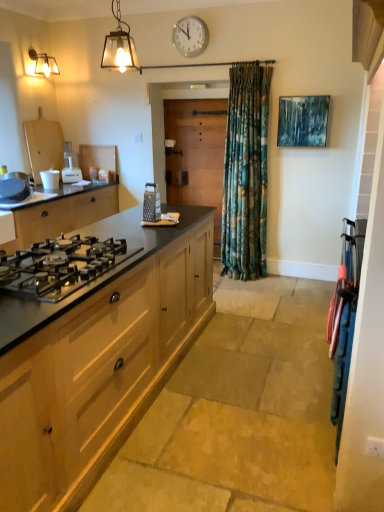
Question: Considering the relative positions of polished stainless steel gas stove at lower left and matte wooden stove at left, the second cabinetry in the right-to-left sequence, in the image provided, is polished stainless steel gas stove at lower left to the right of matte wooden stove at left, the second cabinetry in the right-to-left sequence, from the viewer's perspective?

Choices:
 (A) no
 (B) yes

Answer: (B)

Question: Does polished stainless steel gas stove at lower left have a greater height compared to matte wooden stove at left, the 2th cabinetry viewed from the front?

Choices:
 (A) yes
 (B) no

Answer: (B)

Question: From a real-world perspective, is polished stainless steel gas stove at lower left physically below matte wooden stove at left, the 2th cabinetry viewed from the front?

Choices:
 (A) yes
 (B) no

Answer: (B)

Question: From a real-world perspective, is polished stainless steel gas stove at lower left on top of matte wooden stove at left, which ranks as the 1th cabinetry in left-to-right order?

Choices:
 (A) yes
 (B) no

Answer: (A)

Question: Is the depth of polished stainless steel gas stove at lower left less than that of matte wooden stove at left, the second cabinetry in the right-to-left sequence?

Choices:
 (A) no
 (B) yes

Answer: (B)

Question: Can we say polished stainless steel gas stove at lower left lies outside matte wooden stove at left, the 2th cabinetry viewed from the front?

Choices:
 (A) yes
 (B) no

Answer: (A)

Question: Is matte glass wall sconce at upper left wider than polished stainless steel gas stove at lower left?

Choices:
 (A) yes
 (B) no

Answer: (B)

Question: Does matte glass wall sconce at upper left have a larger size compared to polished stainless steel gas stove at lower left?

Choices:
 (A) no
 (B) yes

Answer: (A)

Question: Is polished stainless steel gas stove at lower left completely or partially inside matte glass wall sconce at upper left?

Choices:
 (A) no
 (B) yes

Answer: (A)

Question: Could you tell me if matte glass wall sconce at upper left is turned towards polished stainless steel gas stove at lower left?

Choices:
 (A) yes
 (B) no

Answer: (B)

Question: Can you confirm if matte glass wall sconce at upper left is positioned to the left of polished stainless steel gas stove at lower left?

Choices:
 (A) yes
 (B) no

Answer: (A)

Question: Does matte glass wall sconce at upper left have a lesser height compared to polished stainless steel gas stove at lower left?

Choices:
 (A) yes
 (B) no

Answer: (B)

Question: Does silver metallic grater at center, positioned as the 4th appliance in top-to-bottom order, have a smaller size compared to matte glass lantern at upper left?

Choices:
 (A) yes
 (B) no

Answer: (A)